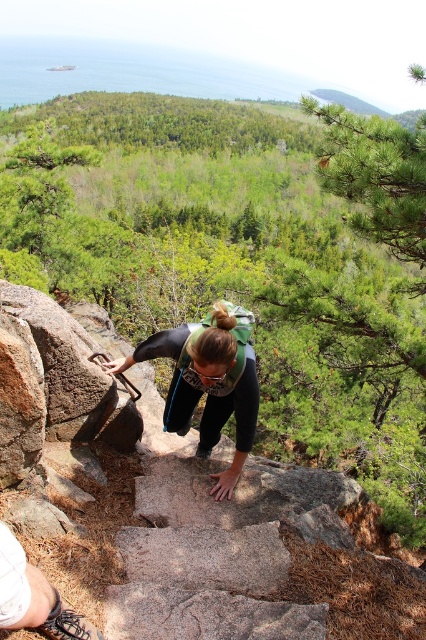
You are a GUI agent. You are given a task and a screenshot of the screen. Output one action in this format:
    pyautogui.click(x=<x>, y=<y>)
    Task: Click on the granite steps at center
    This screenshot has width=426, height=640.
    Given the screenshot: What is the action you would take?
    pyautogui.click(x=238, y=547)

How much distance is there between granite steps at center and matte black pants at center?

granite steps at center is 37.35 inches away from matte black pants at center.

The width and height of the screenshot is (426, 640). What do you see at coordinates (238, 547) in the screenshot?
I see `granite steps at center` at bounding box center [238, 547].

At what (x,y) coordinates should I click in order to perform the action: click on granite steps at center. Please return your answer as a coordinate pair (x, y). Looking at the image, I should click on (238, 547).